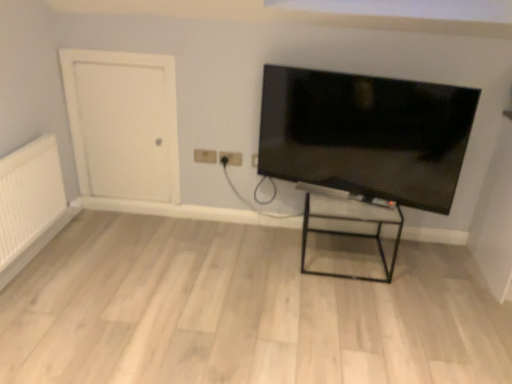
Question: From a real-world perspective, is matte plastic outlet at upper center, the 1th electric outlet when ordered from right to left, on white textured radiator at left?

Choices:
 (A) no
 (B) yes

Answer: (B)

Question: From the image's perspective, is matte plastic outlet at upper center, the 1th electric outlet when ordered from right to left, under white textured radiator at left?

Choices:
 (A) no
 (B) yes

Answer: (A)

Question: Is matte plastic outlet at upper center, the 2th electric outlet viewed from the left, turned away from white textured radiator at left?

Choices:
 (A) yes
 (B) no

Answer: (B)

Question: Is matte plastic outlet at upper center, the 1th electric outlet when ordered from right to left, shorter than white textured radiator at left?

Choices:
 (A) no
 (B) yes

Answer: (B)

Question: Is the depth of matte plastic outlet at upper center, the 2th electric outlet viewed from the left, greater than that of white textured radiator at left?

Choices:
 (A) yes
 (B) no

Answer: (A)

Question: In terms of height, does beige plastic electric outlet at center, placed as the first electric outlet when sorted from left to right, look taller or shorter compared to matte plastic outlet at upper center, the 2th electric outlet viewed from the left?

Choices:
 (A) tall
 (B) short

Answer: (B)

Question: Is beige plastic electric outlet at center, placed as the first electric outlet when sorted from left to right, to the left or to the right of matte plastic outlet at upper center, the 2th electric outlet viewed from the left, in the image?

Choices:
 (A) left
 (B) right

Answer: (A)

Question: Is beige plastic electric outlet at center, placed as the first electric outlet when sorted from left to right, inside or outside of matte plastic outlet at upper center, the 2th electric outlet viewed from the left?

Choices:
 (A) outside
 (B) inside

Answer: (A)

Question: Is point (203, 150) closer or farther from the camera than point (226, 152)?

Choices:
 (A) closer
 (B) farther

Answer: (B)

Question: Does point (1, 168) appear closer or farther from the camera than point (168, 122)?

Choices:
 (A) farther
 (B) closer

Answer: (B)

Question: Relative to white matte door at left, is white textured radiator at left in front or behind?

Choices:
 (A) front
 (B) behind

Answer: (A)

Question: Is white textured radiator at left inside the boundaries of white matte door at left, or outside?

Choices:
 (A) outside
 (B) inside

Answer: (A)

Question: Based on their sizes in the image, would you say white textured radiator at left is bigger or smaller than white matte door at left?

Choices:
 (A) small
 (B) big

Answer: (B)

Question: From a real-world perspective, relative to beige plastic electric outlet at center, placed as the first electric outlet when sorted from left to right, is white textured radiator at left vertically above or below?

Choices:
 (A) above
 (B) below

Answer: (B)

Question: Based on their positions, is white textured radiator at left located to the left or right of beige plastic electric outlet at center, placed as the first electric outlet when sorted from left to right?

Choices:
 (A) right
 (B) left

Answer: (B)